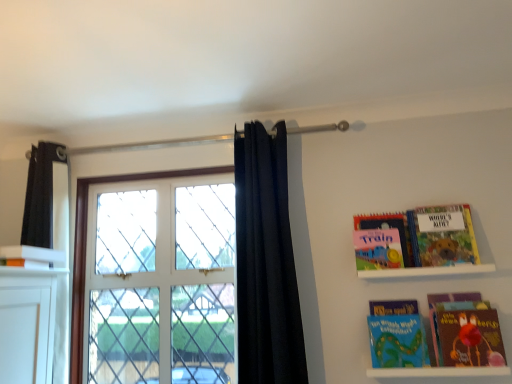
Locate an element on the screen. The width and height of the screenshot is (512, 384). empty space that is ontop of white matte shelf at lower right, marked as the 1th shelf in a bottom-to-top arrangement is located at coordinates (431, 358).